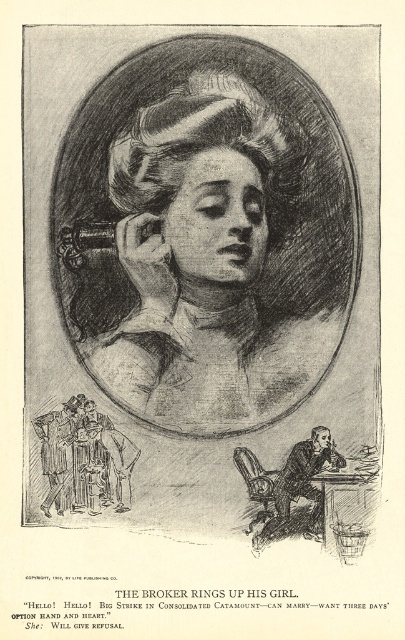
Looking at this image, you are an art conservator examining the image. You notice two points marked in the illustration. The first point is at coordinate point (304, 536) and the second at point (89, 404). Which point is nearer to the viewer?

Point (304, 536) is closer to the camera than point (89, 404), so the first point is nearer to the viewer.